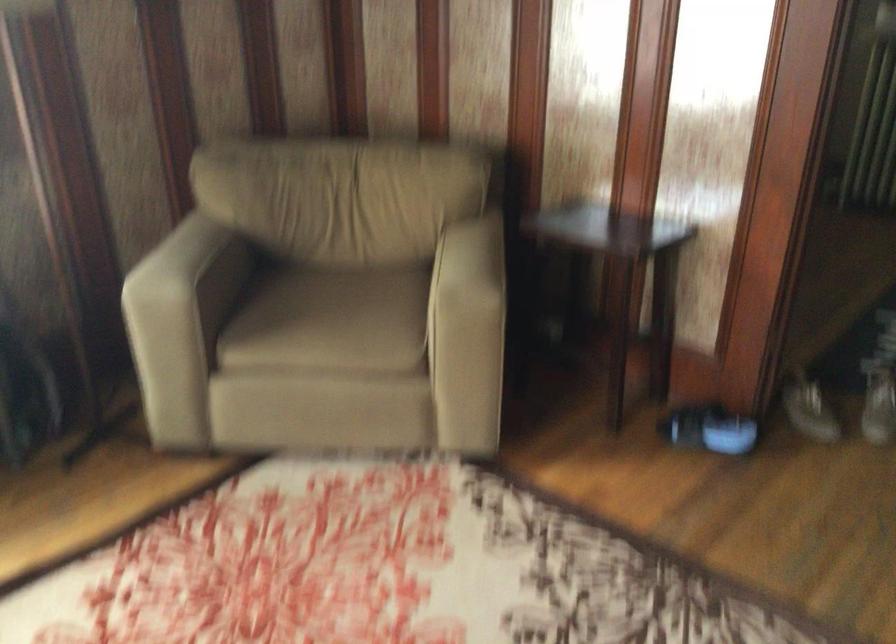
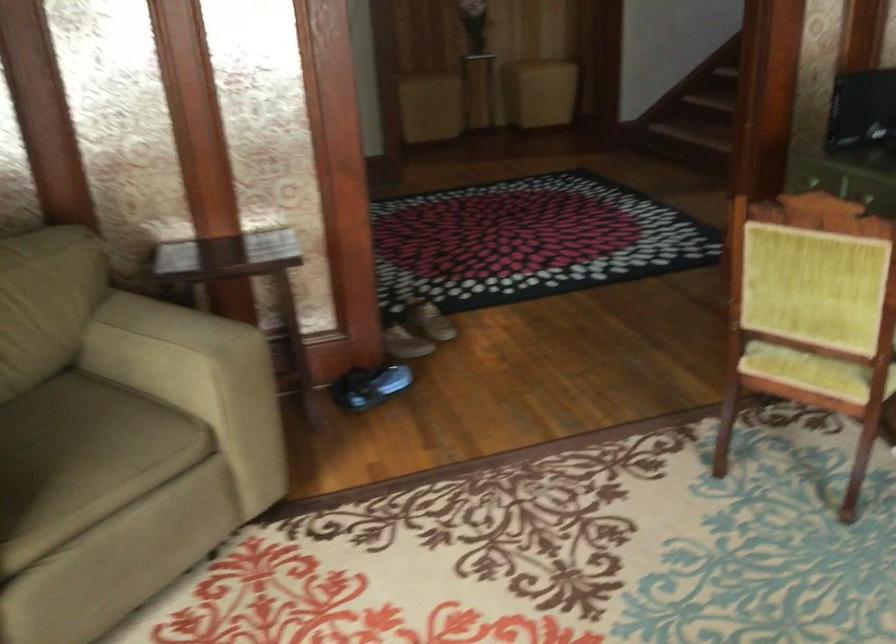
In the second image, find the point that corresponds to the point at 442,270 in the first image.

(153, 345)